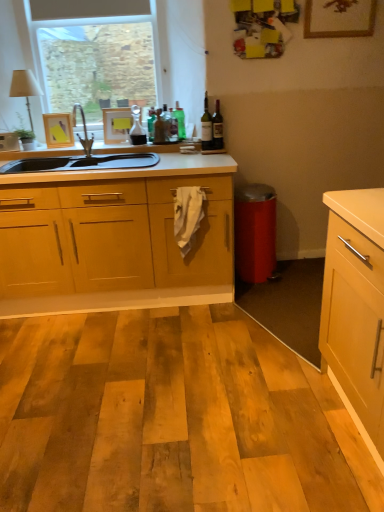
Question: Is the depth of wooden picture frame at upper center, the third picture frame viewed from the back, less than that of translucent glass carafe at center, the 4th bottle from the right?

Choices:
 (A) no
 (B) yes

Answer: (B)

Question: Is wooden picture frame at upper center, which appears as the 1th picture frame when viewed from the right, located outside translucent glass carafe at center, the 4th bottle from the right?

Choices:
 (A) no
 (B) yes

Answer: (B)

Question: Is wooden picture frame at upper center, the first picture frame viewed from the front, at the right side of translucent glass carafe at center, the 4th bottle from the right?

Choices:
 (A) no
 (B) yes

Answer: (B)

Question: Could you tell me if wooden picture frame at upper center, marked as the 3th picture frame in a bottom-to-top arrangement, is facing translucent glass carafe at center, positioned as the 1th bottle in left-to-right order?

Choices:
 (A) yes
 (B) no

Answer: (B)

Question: Is wooden picture frame at upper center, the first picture frame viewed from the front, bigger than translucent glass carafe at center, positioned as the 1th bottle in left-to-right order?

Choices:
 (A) no
 (B) yes

Answer: (A)

Question: Do you think matte white picture frame at upper center, which appears as the second picture frame when ordered from the bottom, is within metallic faucet at upper left, or outside of it?

Choices:
 (A) outside
 (B) inside

Answer: (A)

Question: From the image's perspective, is matte white picture frame at upper center, which appears as the second picture frame when ordered from the bottom, above or below metallic faucet at upper left?

Choices:
 (A) above
 (B) below

Answer: (A)

Question: From a real-world perspective, is matte white picture frame at upper center, which appears as the second picture frame when ordered from the bottom, physically located above or below metallic faucet at upper left?

Choices:
 (A) above
 (B) below

Answer: (B)

Question: In terms of size, does matte white picture frame at upper center, which is the second picture frame from left to right, appear bigger or smaller than metallic faucet at upper left?

Choices:
 (A) small
 (B) big

Answer: (A)

Question: Choose the correct answer: Is green glass bottle at upper center, which ranks as the 3th bottle in right-to-left order, inside metallic faucet at upper left or outside it?

Choices:
 (A) inside
 (B) outside

Answer: (B)

Question: Looking at the image, does green glass bottle at upper center, the 2th bottle from the left, seem bigger or smaller compared to metallic faucet at upper left?

Choices:
 (A) big
 (B) small

Answer: (B)

Question: From the image's perspective, is green glass bottle at upper center, the 2th bottle from the left, positioned above or below metallic faucet at upper left?

Choices:
 (A) above
 (B) below

Answer: (A)

Question: Looking at their shapes, would you say green glass bottle at upper center, which ranks as the 3th bottle in right-to-left order, is wider or thinner than metallic faucet at upper left?

Choices:
 (A) wide
 (B) thin

Answer: (B)

Question: In the image, is translucent glass wine bottle at upper center, the 4th bottle from the left, positioned in front of or behind wooden photo frame at upper left, which is the first picture frame from bottom to top?

Choices:
 (A) behind
 (B) front

Answer: (B)

Question: Is translucent glass wine bottle at upper center, the 4th bottle from the left, to the left or to the right of wooden photo frame at upper left, the second picture frame from the front, in the image?

Choices:
 (A) right
 (B) left

Answer: (A)